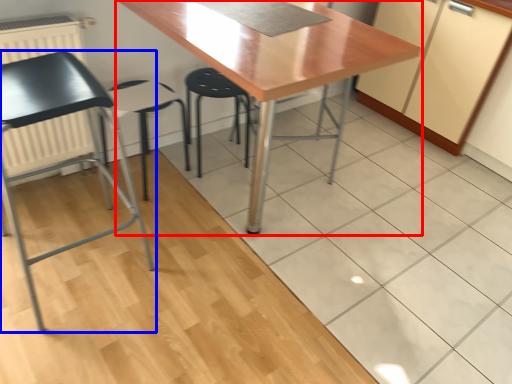
Question: Which object is further to the camera taking this photo, table (highlighted by a red box) or chair (highlighted by a blue box)?

Choices:
 (A) table
 (B) chair

Answer: (A)